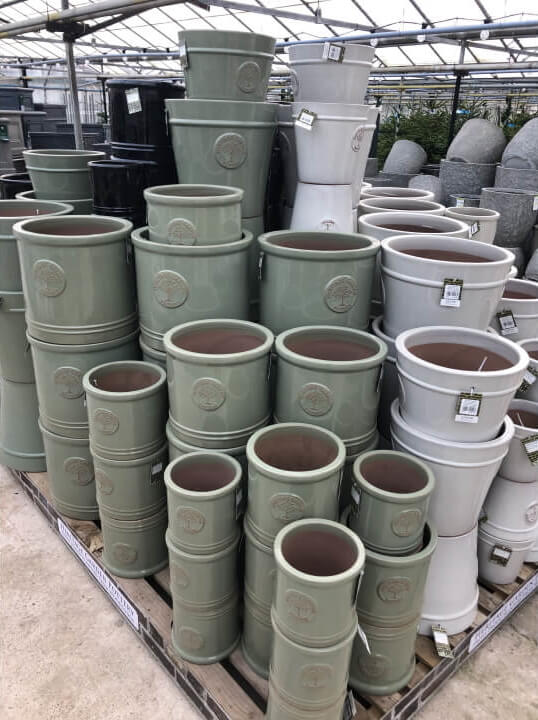
Locate an element on the screen. This screenshot has height=720, width=538. small green pot is located at coordinates (212, 526).